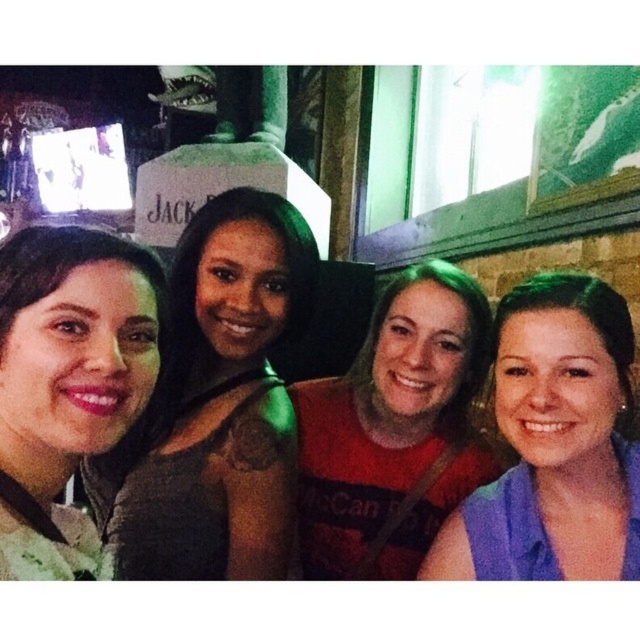
You are standing in the bar and want to take a photo of the matte black dress at left. Where should you position yourself to capture it in the frame?

To capture the matte black dress at left in the frame, position yourself so the dress is centered at coordinates approximately 0.634 on the horizontal axis and 0.338 on the vertical axis.